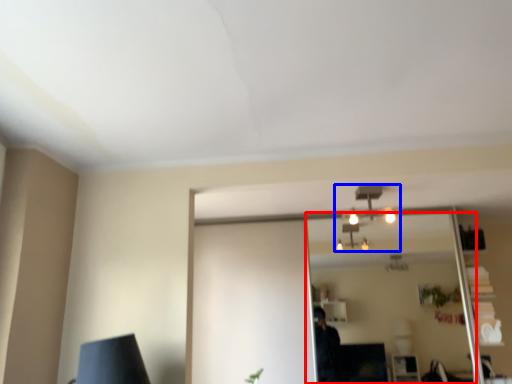
Question: Which object appears farthest to the camera in this image, mirror (highlighted by a red box) or fixture (highlighted by a blue box)?

Choices:
 (A) mirror
 (B) fixture

Answer: (A)